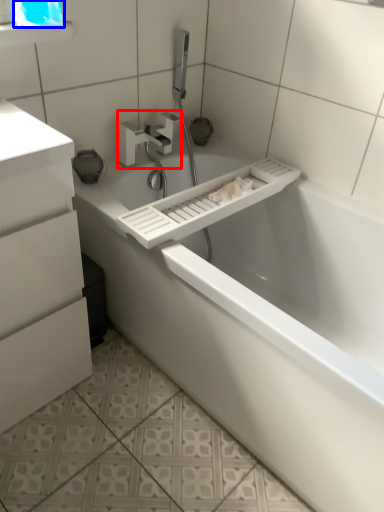
Question: Which object appears farthest to the camera in this image, tap (highlighted by a red box) or window screen (highlighted by a blue box)?

Choices:
 (A) tap
 (B) window screen

Answer: (A)